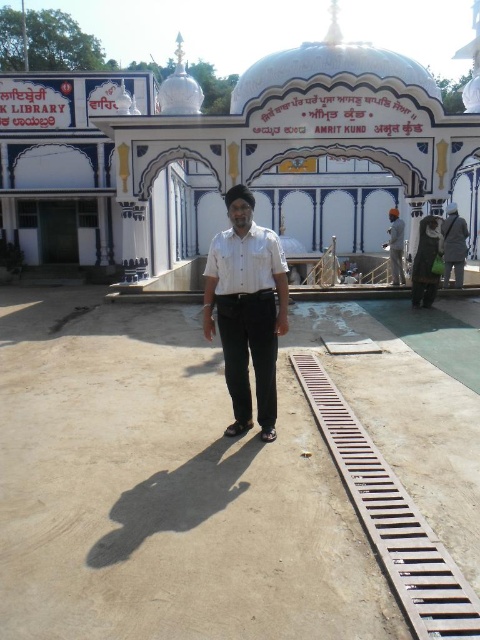
Question: Which is nearer to the dark gray fabric uniform at right?

Choices:
 (A) brown metal train track at lower right
 (B) white cotton shirt at center
 (C) white fabric uniform at lower right

Answer: (C)

Question: Is white cotton shirt at center further to the viewer compared to black fabric bag at lower right?

Choices:
 (A) yes
 (B) no

Answer: (B)

Question: Considering the real-world distances, which object is closest to the black fabric bag at lower right?

Choices:
 (A) white fabric uniform at lower right
 (B) white cotton shirt at center

Answer: (A)

Question: Does brown metal train track at lower right appear over dark gray fabric uniform at right?

Choices:
 (A) no
 (B) yes

Answer: (A)

Question: Which of the following is the closest to the observer?

Choices:
 (A) click(x=405, y=540)
 (B) click(x=392, y=208)

Answer: (A)

Question: Is brown metal train track at lower right smaller than dark gray fabric uniform at right?

Choices:
 (A) yes
 (B) no

Answer: (A)